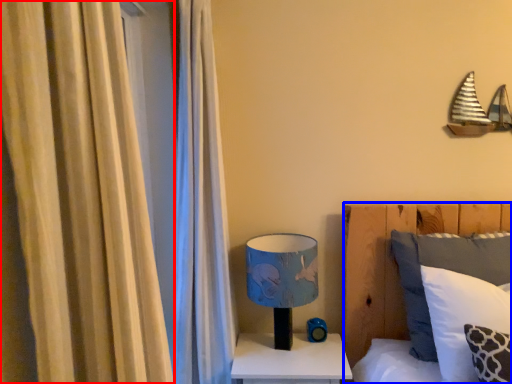
Question: Which object is further to the camera taking this photo, curtain (highlighted by a red box) or bed (highlighted by a blue box)?

Choices:
 (A) curtain
 (B) bed

Answer: (B)